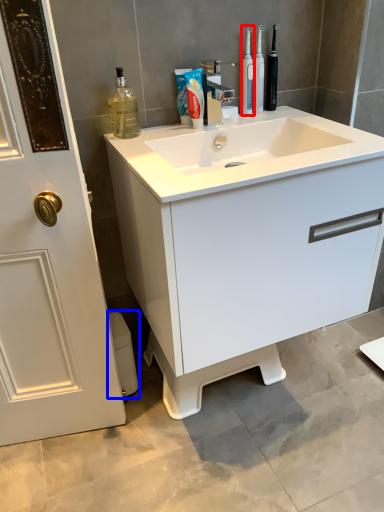
Question: Which object appears closest to the camera in this image, mouthwash (highlighted by a red box) or toilet bowl (highlighted by a blue box)?

Choices:
 (A) mouthwash
 (B) toilet bowl

Answer: (A)